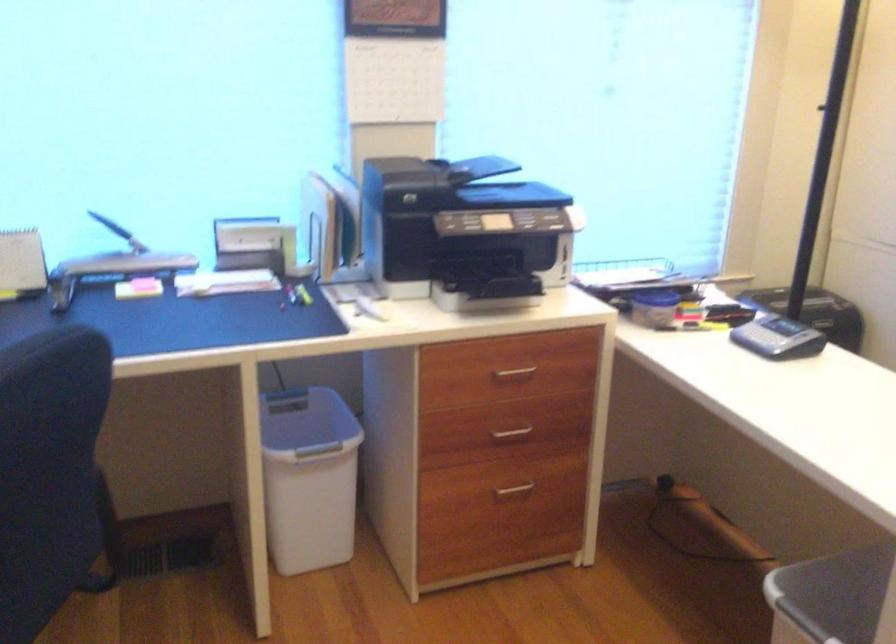
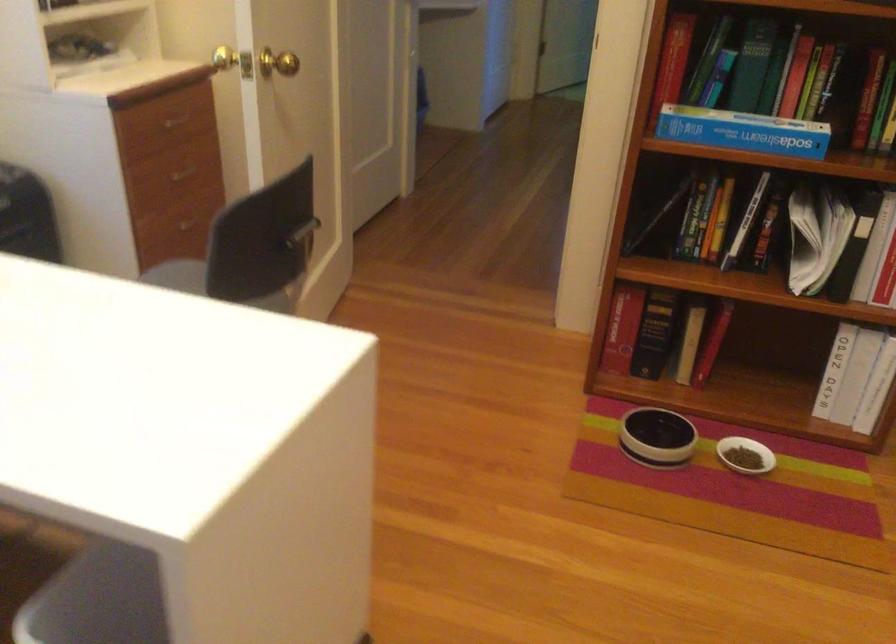
First-person continuous shooting, in which direction is the camera rotating?

The camera's rotation is toward right-down.